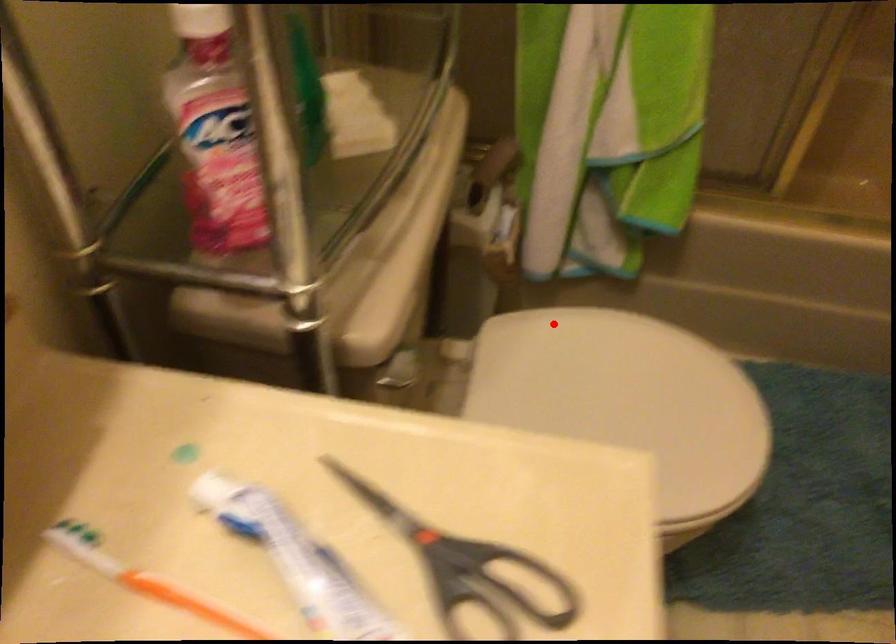
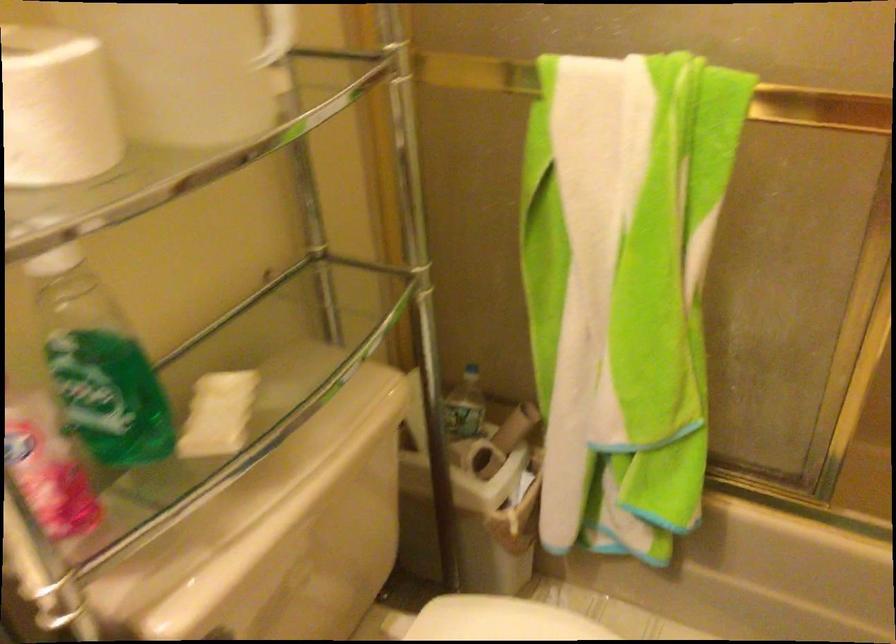
The point at the highlighted location is marked in the first image. Where is the corresponding point in the second image?

(500, 620)